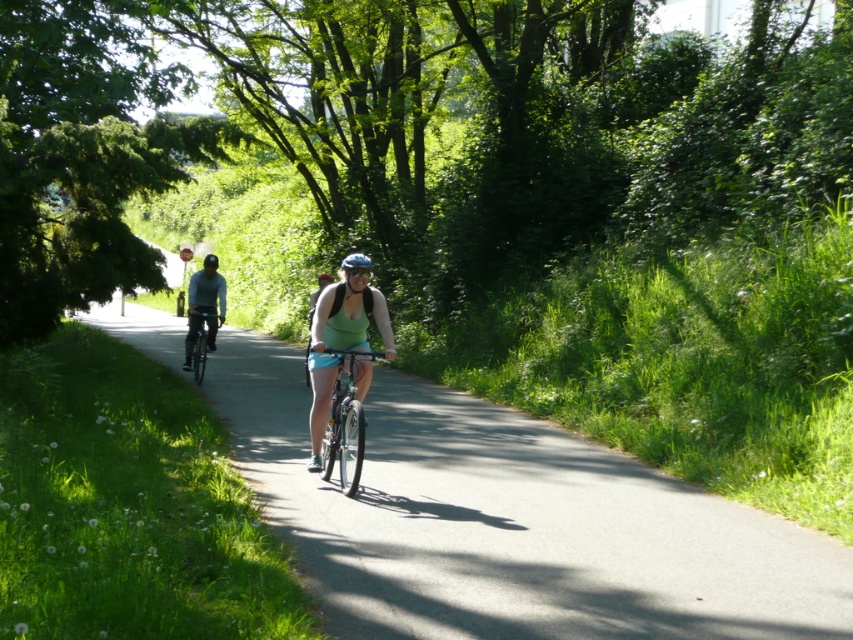
You are a cyclist planning to ride along the asphalt road at center. You have a blue matte bicycle helmet at center. Which object is larger in size?

The asphalt road at center is bigger than the blue matte bicycle helmet at center.